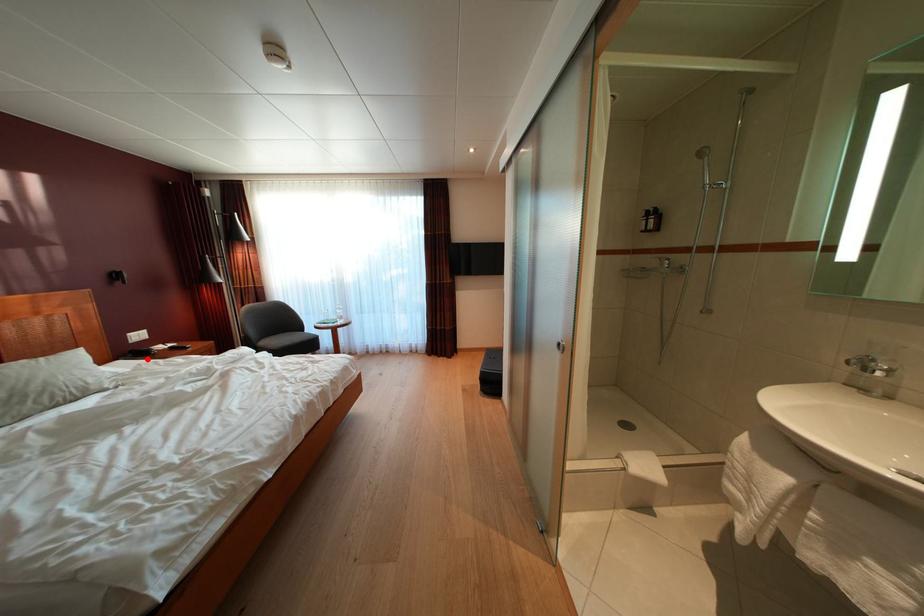
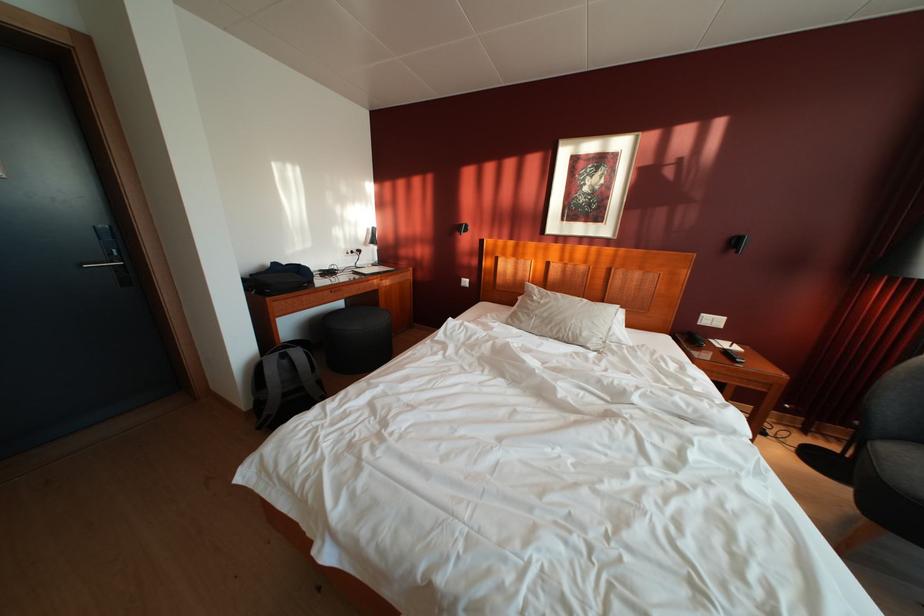
Find the pixel in the second image that matches the highlighted location in the first image.

(698, 344)